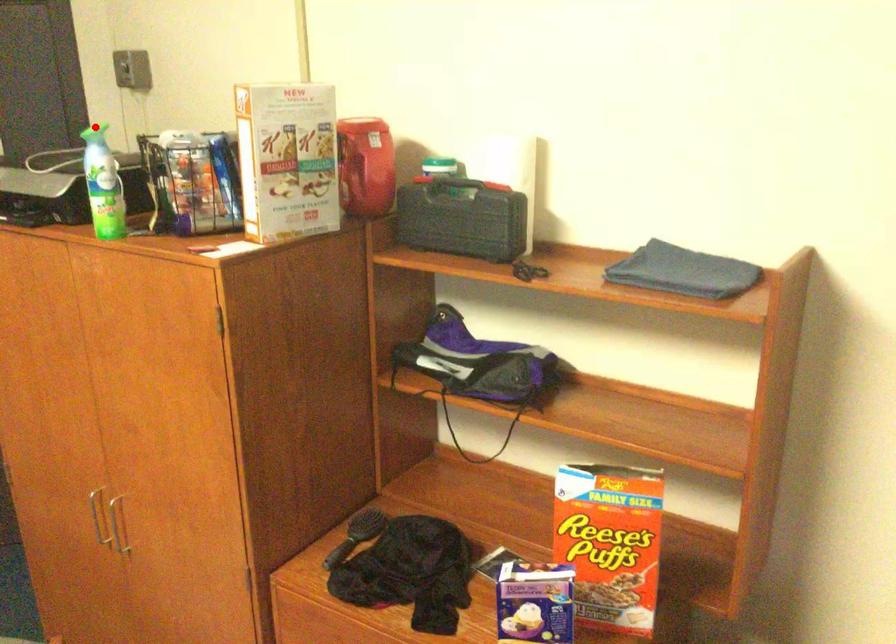
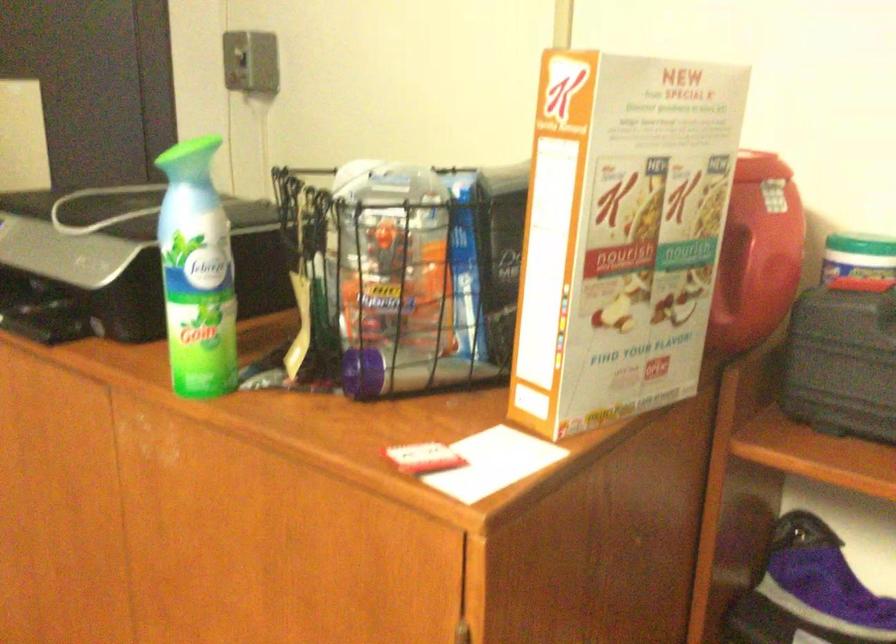
In the second image, find the point that corresponds to the highlighted location in the first image.

(194, 147)